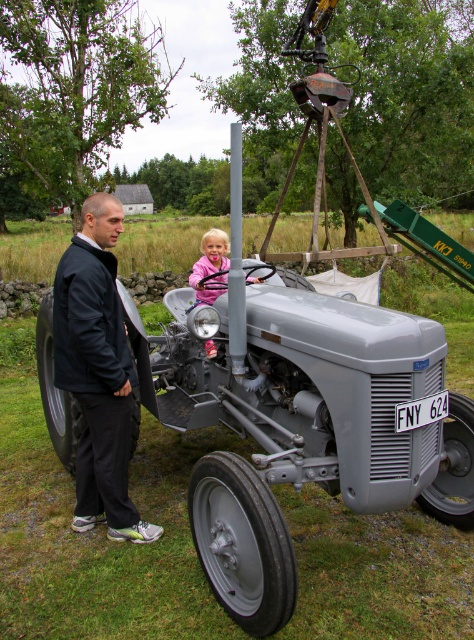
Consider the image. Does metallic gray tractor at center appear under black fabric jacket at left?

No, metallic gray tractor at center is not below black fabric jacket at left.

Is metallic gray tractor at center taller than black fabric jacket at left?

Indeed, metallic gray tractor at center has a greater height compared to black fabric jacket at left.

At what (x,y) coordinates should I click in order to perform the action: click on metallic gray tractor at center. Please return your answer as a coordinate pair (x, y). Looking at the image, I should click on (300, 422).

In the scene shown: Between black fabric jacket at left and pink fabric at center, which one has more height?

black fabric jacket at left is taller.

Based on the photo, can you confirm if black fabric jacket at left is bigger than pink fabric at center?

Incorrect, black fabric jacket at left is not larger than pink fabric at center.

At what (x,y) coordinates should I click in order to perform the action: click on black fabric jacket at left. Please return your answer as a coordinate pair (x, y). Looking at the image, I should click on (98, 371).

Does metallic gray tractor at center appear on the right side of pink fabric at center?

Indeed, metallic gray tractor at center is positioned on the right side of pink fabric at center.

Which is below, metallic gray tractor at center or pink fabric at center?

metallic gray tractor at center is below.

Does point (320, 378) lie in front of point (211, 260)?

Yes, point (320, 378) is in front of point (211, 260).

Identify the location of metallic gray tractor at center. (300, 422).